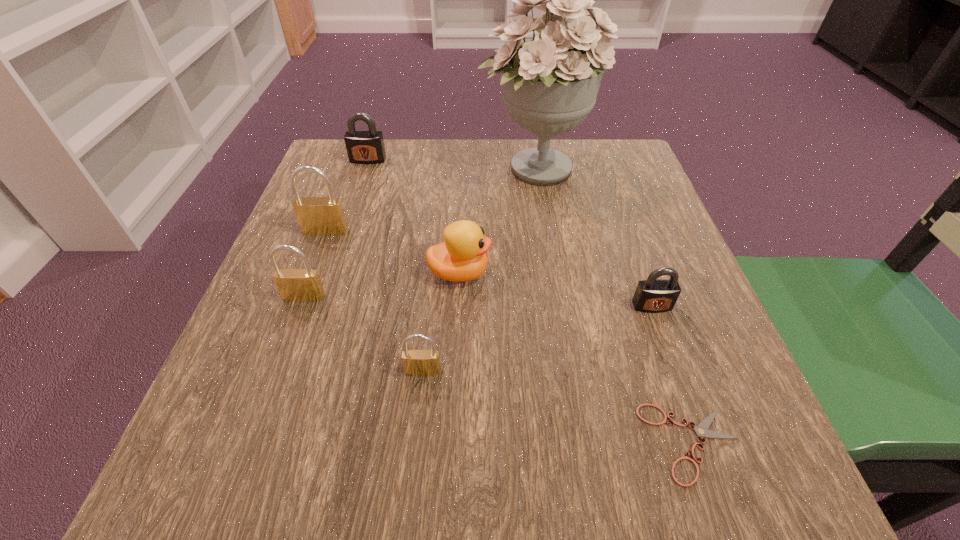
Locate an element on the screen. This screenshot has width=960, height=540. vacant area situated on the front of the smaller gray padlock near the keyhole is located at coordinates (681, 389).

The height and width of the screenshot is (540, 960). In order to click on vacant point located on the front-facing side of the rightmost brass padlock in this screenshot , I will do `click(417, 435)`.

At what (x,y) coordinates should I click in order to perform the action: click on vacant space located 0.360m on the back of the nearest object. Please return your answer as a coordinate pair (x, y). Looking at the image, I should click on (622, 238).

The height and width of the screenshot is (540, 960). What are the coordinates of `bouquet located at the far edge` in the screenshot? It's located at (550, 83).

Find the location of a particular element. Image resolution: width=960 pixels, height=540 pixels. padlock that is at the far edge is located at coordinates (363, 147).

Identify the location of object present at the near edge. The width and height of the screenshot is (960, 540). (701, 430).

Locate an element on the screen. bouquet situated at the right edge is located at coordinates (550, 83).

Where is `padlock that is positioned at the right edge`? padlock that is positioned at the right edge is located at coordinates (653, 295).

The height and width of the screenshot is (540, 960). Find the location of `shears located at the right edge`. shears located at the right edge is located at coordinates (701, 430).

Where is `object present at the far left corner`? This screenshot has width=960, height=540. object present at the far left corner is located at coordinates (363, 147).